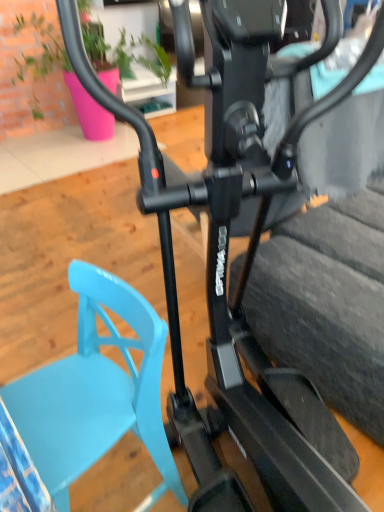
Where is `black rubber tire at center`? Image resolution: width=384 pixels, height=512 pixels. black rubber tire at center is located at coordinates (321, 326).

Locate an element on the screen. The width and height of the screenshot is (384, 512). matte green plant at upper center is located at coordinates (121, 50).

The height and width of the screenshot is (512, 384). I want to click on light blue plastic swivel chair at lower left, so (96, 391).

Is light blue plastic swivel chair at lower left bigger than matte green plant at upper center?

Actually, light blue plastic swivel chair at lower left might be smaller than matte green plant at upper center.

Between point (90, 390) and point (61, 62), which one is positioned behind?

The point (61, 62) is behind.

From the image's perspective, does light blue plastic swivel chair at lower left appear lower than matte green plant at upper center?

Yes.

Does light blue plastic swivel chair at lower left turn towards matte green plant at upper center?

No, light blue plastic swivel chair at lower left is not facing towards matte green plant at upper center.

Is light blue plastic swivel chair at lower left in contact with black rubber tire at center?

light blue plastic swivel chair at lower left is not next to black rubber tire at center, and they're not touching.

Which is behind, point (58, 406) or point (274, 340)?

Positioned behind is point (274, 340).

At what (x,y) coordinates should I click in order to perform the action: click on tire above the light blue plastic swivel chair at lower left (from the image's perspective). Please return your answer as a coordinate pair (x, y). Looking at the image, I should click on [321, 326].

Considering the sizes of objects light blue plastic swivel chair at lower left and black rubber tire at center in the image provided, who is taller, light blue plastic swivel chair at lower left or black rubber tire at center?

black rubber tire at center is taller.

From a real-world perspective, which object stands above the other?

matte green plant at upper center.

Considering the positions of points (45, 73) and (57, 376), is point (45, 73) farther from camera compared to point (57, 376)?

Yes, point (45, 73) is farther from viewer.

In the scene shown: Can you confirm if matte green plant at upper center is bigger than light blue plastic swivel chair at lower left?

Yes, matte green plant at upper center is bigger than light blue plastic swivel chair at lower left.

Is matte green plant at upper center taller than black rubber tire at center?

Indeed, matte green plant at upper center has a greater height compared to black rubber tire at center.

From a real-world perspective, is matte green plant at upper center on black rubber tire at center?

Correct, in the physical world, matte green plant at upper center is higher than black rubber tire at center.

Is matte green plant at upper center inside or outside of black rubber tire at center?

matte green plant at upper center exists outside the volume of black rubber tire at center.

The height and width of the screenshot is (512, 384). In order to click on tire below the matte green plant at upper center (from a real-world perspective) in this screenshot , I will do `click(321, 326)`.

Considering the relative sizes of black rubber tire at center and light blue plastic swivel chair at lower left in the image provided, is black rubber tire at center thinner than light blue plastic swivel chair at lower left?

No, black rubber tire at center is not thinner than light blue plastic swivel chair at lower left.

Considering the positions of objects black rubber tire at center and light blue plastic swivel chair at lower left in the image provided, who is more to the right, black rubber tire at center or light blue plastic swivel chair at lower left?

black rubber tire at center.

Would you consider black rubber tire at center to be distant from light blue plastic swivel chair at lower left?

No, there isn't a large distance between black rubber tire at center and light blue plastic swivel chair at lower left.

Between black rubber tire at center and matte green plant at upper center, which one has smaller width?

black rubber tire at center is thinner.

In terms of height, does black rubber tire at center look taller or shorter compared to matte green plant at upper center?

black rubber tire at center is shorter than matte green plant at upper center.

Is matte green plant at upper center at the back of black rubber tire at center?

No.

Image resolution: width=384 pixels, height=512 pixels. I want to click on swivel chair that appears in front of the matte green plant at upper center, so click(96, 391).

The width and height of the screenshot is (384, 512). Find the location of `tire on the right of light blue plastic swivel chair at lower left`. tire on the right of light blue plastic swivel chair at lower left is located at coordinates [321, 326].

Considering their positions, is light blue plastic swivel chair at lower left positioned further to black rubber tire at center than matte green plant at upper center?

matte green plant at upper center is positioned further to the anchor black rubber tire at center.

From the image, which object appears to be farther from matte green plant at upper center, light blue plastic swivel chair at lower left or black rubber tire at center?

light blue plastic swivel chair at lower left is further to matte green plant at upper center.

Considering their positions, is matte green plant at upper center positioned closer to black rubber tire at center than light blue plastic swivel chair at lower left?

light blue plastic swivel chair at lower left is positioned closer to the anchor black rubber tire at center.

Which object lies further to the anchor point light blue plastic swivel chair at lower left, black rubber tire at center or matte green plant at upper center?

Among the two, matte green plant at upper center is located further to light blue plastic swivel chair at lower left.

Based on their spatial positions, is black rubber tire at center or light blue plastic swivel chair at lower left further from matte green plant at upper center?

Based on the image, light blue plastic swivel chair at lower left appears to be further to matte green plant at upper center.

Considering their positions, is matte green plant at upper center positioned closer to light blue plastic swivel chair at lower left than black rubber tire at center?

black rubber tire at center is positioned closer to the anchor light blue plastic swivel chair at lower left.

At what (x,y) coordinates should I click in order to perform the action: click on tire between light blue plastic swivel chair at lower left and matte green plant at upper center from front to back. Please return your answer as a coordinate pair (x, y). This screenshot has width=384, height=512. Looking at the image, I should click on (321, 326).